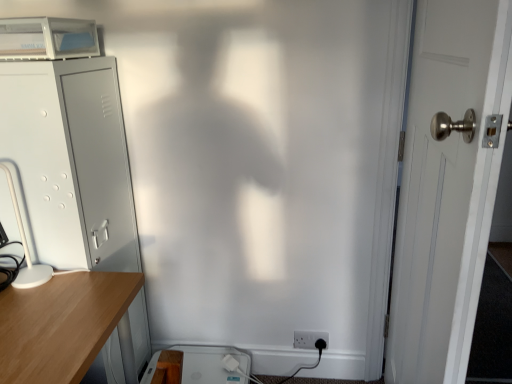
Question: Could white plastic electric outlet at lower right be considered to be inside white plastic table lamp at left?

Choices:
 (A) yes
 (B) no

Answer: (B)

Question: Does white plastic table lamp at left have a smaller size compared to white plastic electric outlet at lower right?

Choices:
 (A) no
 (B) yes

Answer: (A)

Question: Considering the relative sizes of white plastic table lamp at left and white plastic electric outlet at lower right in the image provided, is white plastic table lamp at left wider than white plastic electric outlet at lower right?

Choices:
 (A) yes
 (B) no

Answer: (A)

Question: Is the position of white plastic table lamp at left less distant than that of white plastic electric outlet at lower right?

Choices:
 (A) no
 (B) yes

Answer: (B)

Question: Is white plastic table lamp at left to the left of white plastic electric outlet at lower right from the viewer's perspective?

Choices:
 (A) no
 (B) yes

Answer: (B)

Question: Would you say white plastic table lamp at left is outside white plastic electric outlet at lower right?

Choices:
 (A) no
 (B) yes

Answer: (B)

Question: From the image's perspective, is white plastic electric outlet at lower right over white plastic table lamp at left?

Choices:
 (A) no
 (B) yes

Answer: (A)

Question: Can you confirm if white plastic electric outlet at lower right is smaller than white plastic table lamp at left?

Choices:
 (A) no
 (B) yes

Answer: (B)

Question: Is the position of white plastic electric outlet at lower right less distant than that of white plastic table lamp at left?

Choices:
 (A) yes
 (B) no

Answer: (B)

Question: From a real-world perspective, is white plastic electric outlet at lower right located higher than white plastic table lamp at left?

Choices:
 (A) no
 (B) yes

Answer: (A)

Question: Is white plastic electric outlet at lower right outside of white plastic table lamp at left?

Choices:
 (A) yes
 (B) no

Answer: (A)

Question: Is white plastic electric outlet at lower right to the right of white plastic table lamp at left from the viewer's perspective?

Choices:
 (A) no
 (B) yes

Answer: (B)

Question: Is gray metallic file cabinet at left at the left side of white plastic table lamp at left?

Choices:
 (A) yes
 (B) no

Answer: (B)